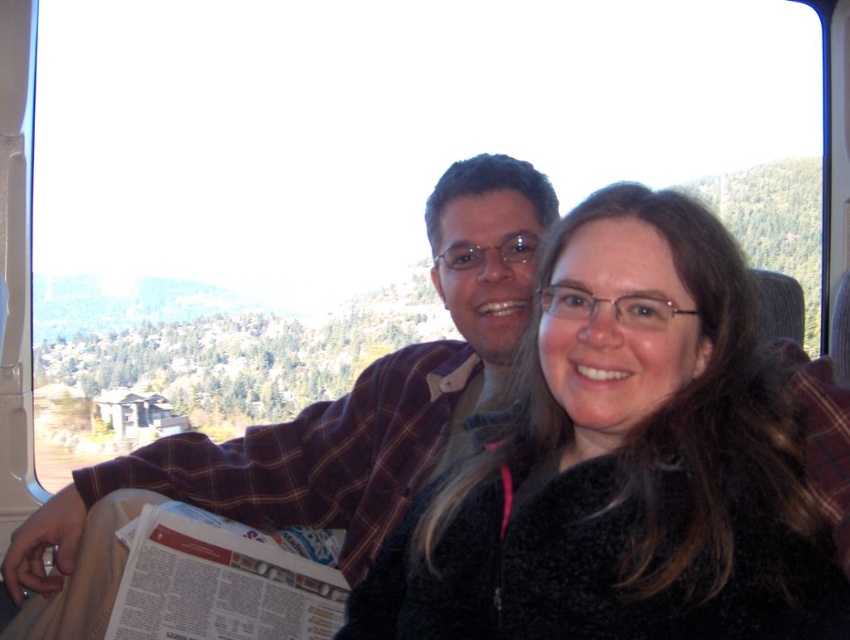
Question: Does black fuzzy jacket at center appear under plaid fabric shirt at center?

Choices:
 (A) no
 (B) yes

Answer: (B)

Question: Does black fuzzy jacket at center appear on the right side of plaid fabric shirt at center?

Choices:
 (A) yes
 (B) no

Answer: (A)

Question: Among these objects, which one is nearest to the camera?

Choices:
 (A) plaid fabric shirt at center
 (B) black fuzzy jacket at center

Answer: (B)

Question: From the image, what is the correct spatial relationship of black fuzzy jacket at center in relation to plaid fabric shirt at center?

Choices:
 (A) left
 (B) right

Answer: (B)

Question: Which point is closer to the camera?

Choices:
 (A) black fuzzy jacket at center
 (B) plaid fabric shirt at center

Answer: (A)